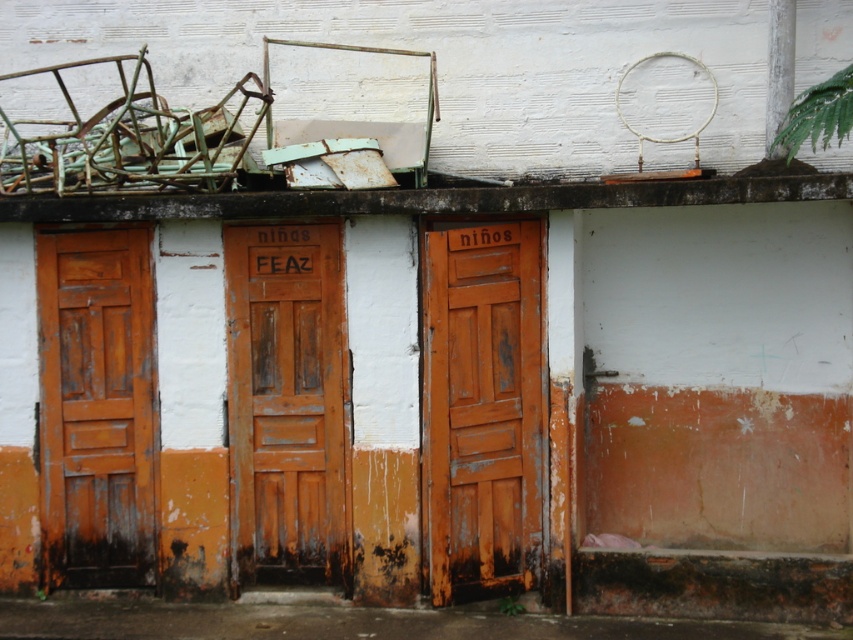
Looking at this image, you are standing in front of the building and want to enter through the doors. Which door, the rusty wood door at center or the rusty wood door at left, is closer to you?

The rusty wood door at center is closer to you because it is in front of the rusty wood door at left.

You are a delivery person trying to deliver a large package that requires a doorway at least 3 feet wide. You see two doors in the scene, the rusty wood door at center and the rusty wood door at left. Which door should you choose to ensure the package fits through?

The rusty wood door at center might be wider than rusty wood door at left, so you should choose the rusty wood door at center to ensure the package fits through.